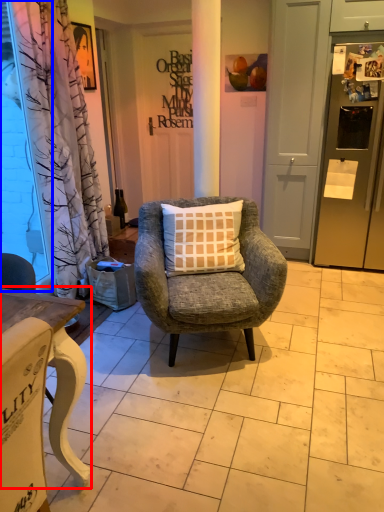
Question: Which point is closer to the camera, desk (highlighted by a red box) or window screen (highlighted by a blue box)?

Choices:
 (A) desk
 (B) window screen

Answer: (A)